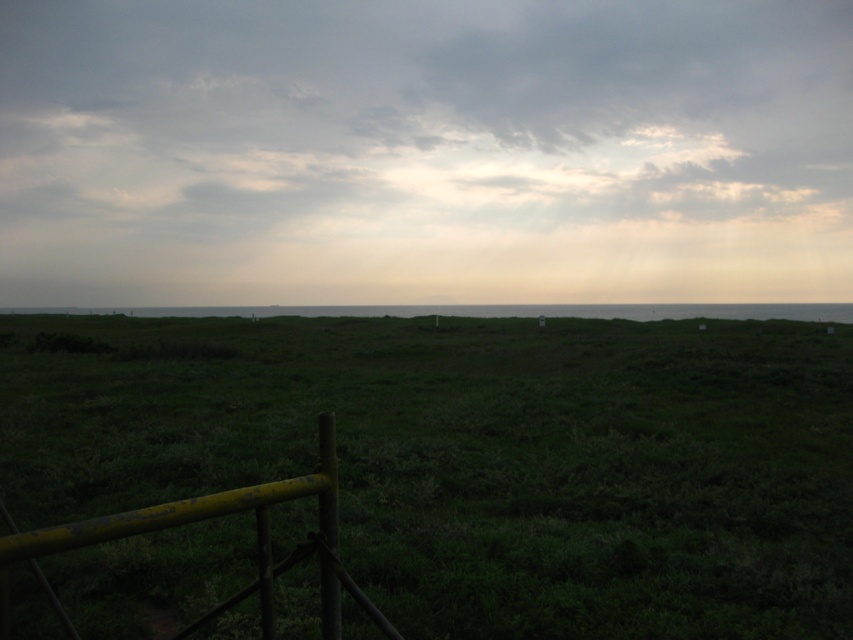
You are standing on the grassy area in the foreground of the coastal landscape. You notice a specific point marked at coordinates point (424, 150). What object or feature does this point indicate?

The point (424, 150) marks cloudy sky at upper center.

You are standing in the coastal landscape and want to take a photo of the cloudy sky at upper center and the yellow painted wood fence at lower left. Which object will appear larger in the photo?

The cloudy sky at upper center will appear larger in the photo because it is much taller than the yellow painted wood fence at lower left.